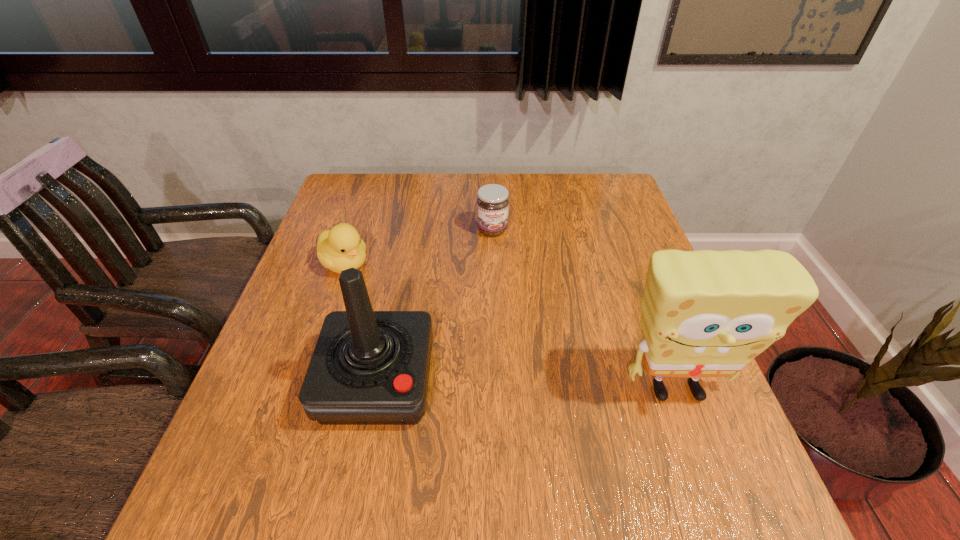
This screenshot has height=540, width=960. I want to click on vacant space at the left edge of the desktop, so click(x=335, y=287).

Where is `vacant region at the right edge of the desktop`? The width and height of the screenshot is (960, 540). vacant region at the right edge of the desktop is located at coordinates (634, 328).

Where is `vacant region at the far left corner of the desktop`? vacant region at the far left corner of the desktop is located at coordinates (339, 184).

You are a GUI agent. You are given a task and a screenshot of the screen. Output one action in this format:
    pyautogui.click(x=<x>, y=<y>)
    Task: Click on the free spot at the near left corner of the desktop
    
    Given the screenshot: What is the action you would take?
    pyautogui.click(x=240, y=443)

The width and height of the screenshot is (960, 540). I want to click on vacant space at the far right corner, so click(600, 176).

Locate an element on the screen. The width and height of the screenshot is (960, 540). vacant region at the near right corner of the desktop is located at coordinates (645, 421).

The image size is (960, 540). I want to click on free point between the joystick and the jam, so click(435, 306).

The width and height of the screenshot is (960, 540). Identify the location of free space between the rightmost object and the third object from left to right. (584, 310).

Identify the location of empty location between the joystick and the second object from right to left. This screenshot has width=960, height=540. (435, 306).

Locate an element on the screen. free spot between the farthest object and the joystick is located at coordinates (435, 306).